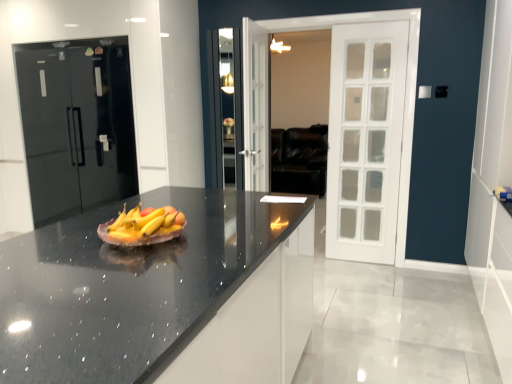
Measure the distance between point (26,138) and camera.

Point (26,138) and camera are 3.76 meters apart.

Describe the element at coordinates (143, 227) in the screenshot. Image resolution: width=512 pixels, height=384 pixels. I see `matte ceramic grapefruit at center` at that location.

At what (x,y) coordinates should I click in order to perform the action: click on white door at right. Please return your answer as a coordinate pair (x, y). The width and height of the screenshot is (512, 384). Looking at the image, I should click on (493, 185).

Where is `glossy black refrigerator at left`? glossy black refrigerator at left is located at coordinates (76, 125).

How different are the orientations of white door at right and black granite countertop at center in degrees?

0.817 degrees.

Are white door at right and black granite countertop at center far apart?

white door at right is far away from black granite countertop at center.

Looking at this image, from a real-world perspective, is white door at right on black granite countertop at center?

Yes.

Is white door at right turned away from glossy black refrigerator at left?

No, white door at right is not facing the opposite direction of glossy black refrigerator at left.

From a real-world perspective, between white door at right and glossy black refrigerator at left, who is vertically lower?

In real-world perspective, glossy black refrigerator at left is lower.

Considering the sizes of white door at right and glossy black refrigerator at left in the image, is white door at right taller or shorter than glossy black refrigerator at left?

Clearly, white door at right is taller compared to glossy black refrigerator at left.

How many degrees apart are the facing directions of white door at right and glossy black refrigerator at left?

The facing directions of white door at right and glossy black refrigerator at left are 91.7 degrees apart.

In terms of width, does matte ceramic grapefruit at center look wider or thinner when compared to black granite countertop at center?

matte ceramic grapefruit at center is thinner than black granite countertop at center.

From a real-world perspective, who is located lower, matte ceramic grapefruit at center or black granite countertop at center?

black granite countertop at center is physically lower.

Is matte ceramic grapefruit at center closer to camera compared to black granite countertop at center?

No, the depth of matte ceramic grapefruit at center is greater than that of black granite countertop at center.

Is black granite countertop at center taller or shorter than matte ceramic grapefruit at center?

Considering their sizes, black granite countertop at center has more height than matte ceramic grapefruit at center.

Which is behind, point (205, 264) or point (148, 225)?

Positioned behind is point (148, 225).

In the image, is black granite countertop at center positioned in front of or behind matte ceramic grapefruit at center?

black granite countertop at center is in front of matte ceramic grapefruit at center.

From a real-world perspective, relative to matte ceramic grapefruit at center, is black granite countertop at center vertically above or below?

black granite countertop at center is below matte ceramic grapefruit at center.

Is matte ceramic grapefruit at center facing away from white door at right?

No, white door at right is not at the back of matte ceramic grapefruit at center.

From the image's perspective, is matte ceramic grapefruit at center located above or below white door at right?

Clearly, from the image's perspective, matte ceramic grapefruit at center is below white door at right.

Is matte ceramic grapefruit at center not inside white door at right?

Indeed, matte ceramic grapefruit at center is completely outside white door at right.

In the scene shown: Does matte ceramic grapefruit at center have a greater height compared to white door at right?

In fact, matte ceramic grapefruit at center may be shorter than white door at right.

Is point (26, 100) closer to viewer compared to point (133, 208)?

No.

From the picture: Is glossy black refrigerator at left bigger or smaller than matte ceramic grapefruit at center?

Clearly, glossy black refrigerator at left is larger in size than matte ceramic grapefruit at center.

In the scene shown: From a real-world perspective, relative to matte ceramic grapefruit at center, is glossy black refrigerator at left vertically above or below?

In terms of real-world spatial position, glossy black refrigerator at left is above matte ceramic grapefruit at center.

Considering the relative sizes of white door at right and matte ceramic grapefruit at center in the image provided, is white door at right smaller than matte ceramic grapefruit at center?

Incorrect, white door at right is not smaller in size than matte ceramic grapefruit at center.

Image resolution: width=512 pixels, height=384 pixels. What are the coordinates of `grapefruit below the white door at right (from the image's perspective)` in the screenshot? It's located at (143, 227).

Is white door at right in front of or behind matte ceramic grapefruit at center in the image?

white door at right is behind matte ceramic grapefruit at center.

Where is `side located above the black granite countertop at center (from a real-world perspective)`? side located above the black granite countertop at center (from a real-world perspective) is located at coordinates (493, 185).

At what (x,y) coordinates should I click in order to perform the action: click on side located below the glossy black refrigerator at left (from the image's perspective). Please return your answer as a coordinate pair (x, y). Looking at the image, I should click on (493, 185).

Looking at the image, which one is located closer to white door at right, glossy black refrigerator at left or matte ceramic grapefruit at center?

matte ceramic grapefruit at center.

Estimate the real-world distances between objects in this image. Which object is closer to glossy black refrigerator at left, matte ceramic grapefruit at center or white door at right?

matte ceramic grapefruit at center.

Based on their spatial positions, is white door at right or matte ceramic grapefruit at center closer to black granite countertop at center?

Among the two, matte ceramic grapefruit at center is located nearer to black granite countertop at center.

Looking at the image, which one is located further to black granite countertop at center, glossy black refrigerator at left or matte ceramic grapefruit at center?

Based on the image, glossy black refrigerator at left appears to be further to black granite countertop at center.

In the scene shown: Which object lies nearer to the anchor point glossy black refrigerator at left, white door at right or matte ceramic grapefruit at center?

matte ceramic grapefruit at center is closer to glossy black refrigerator at left.

From the image, which object appears to be nearer to matte ceramic grapefruit at center, white door at right or black granite countertop at center?

The object closer to matte ceramic grapefruit at center is black granite countertop at center.

From the image, which object appears to be farther from white door at right, matte ceramic grapefruit at center or glossy black refrigerator at left?

glossy black refrigerator at left is positioned further to the anchor white door at right.

Looking at this image, estimate the real-world distances between objects in this image. Which object is further from matte ceramic grapefruit at center, glossy black refrigerator at left or black granite countertop at center?

glossy black refrigerator at left lies further to matte ceramic grapefruit at center than the other object.

Where is `countertop situated between matte ceramic grapefruit at center and white door at right from left to right`? countertop situated between matte ceramic grapefruit at center and white door at right from left to right is located at coordinates (161, 296).

You are a GUI agent. You are given a task and a screenshot of the screen. Output one action in this format:
    pyautogui.click(x=<x>, y=<y>)
    Task: Click on the grapefruit between black granite countertop at center and glossy black refrigerator at left along the z-axis
    This screenshot has height=384, width=512.
    Given the screenshot: What is the action you would take?
    pyautogui.click(x=143, y=227)

Where is `grapefruit between glossy black refrigerator at left and white door at right from left to right`? grapefruit between glossy black refrigerator at left and white door at right from left to right is located at coordinates (143, 227).

This screenshot has height=384, width=512. I want to click on countertop between glossy black refrigerator at left and white door at right in the horizontal direction, so click(x=161, y=296).